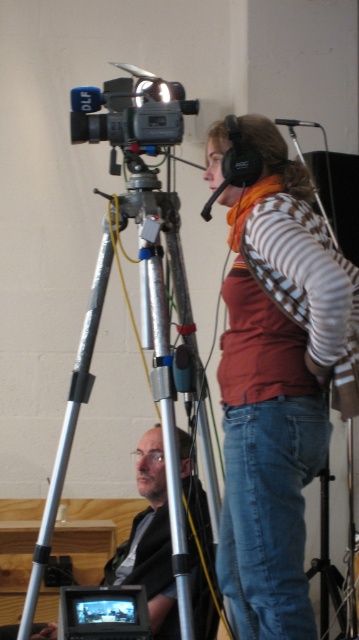
You are standing at the point labeled point [114,93] and want to move to the point labeled point [322,232]. Which direction should you walk to reach your destination?

To reach point [322,232] from point [114,93], you should walk forward since point [322,232] is in front of point [114,93].

You are standing in front of the video camera setup. There are two points marked in the scene. The first point is at coordinates point (187, 310) and the second point is at point (159, 115). Which point is closer to you?

Point (187, 310) is further to the viewer than point (159, 115), so the second point is closer to you.